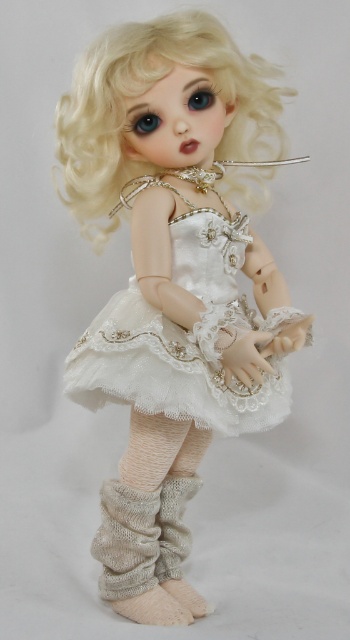
Question: Is blonde curly hair at upper center above beige knitted boot at lower center?

Choices:
 (A) no
 (B) yes

Answer: (B)

Question: Which of these objects is positioned farthest from the beige knitted boot at lower center?

Choices:
 (A) blonde curly hair at upper center
 (B) white satin dress at center
 (C) white lace dress at center
 (D) knitted beige boot at lower center

Answer: (A)

Question: Which of the following is the closest to the observer?

Choices:
 (A) (169, 561)
 (B) (185, 362)

Answer: (B)

Question: Can you confirm if white lace dress at center is wider than beige knitted boot at lower center?

Choices:
 (A) no
 (B) yes

Answer: (B)

Question: From the image, what is the correct spatial relationship of white satin dress at center in relation to knitted beige boot at lower center?

Choices:
 (A) left
 (B) right

Answer: (B)

Question: Which point is farther to the camera?

Choices:
 (A) white satin dress at center
 (B) knitted beige boot at lower center

Answer: (B)